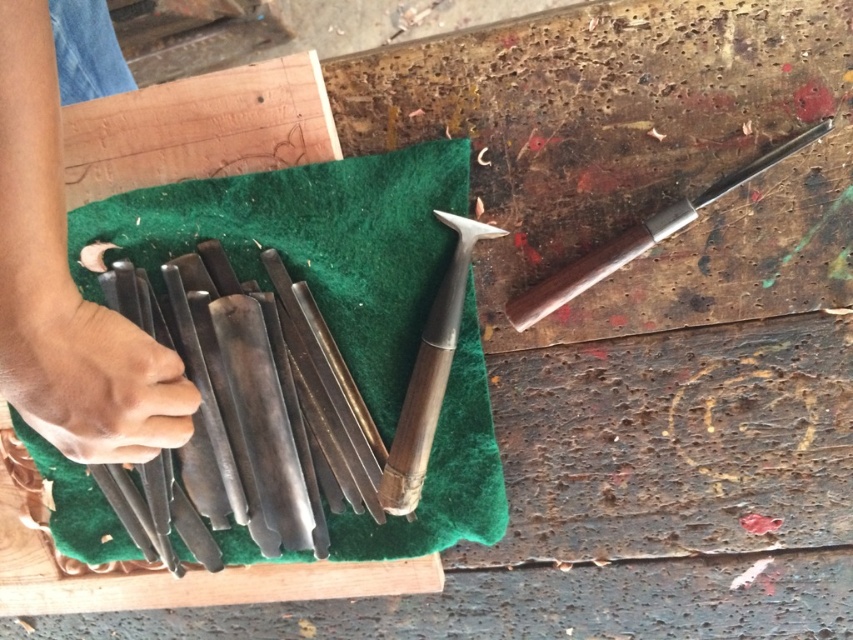
You are trying to determine if the smooth wood at upper left can fit horizontally across the wooden handle chisel at center. Based on their widths, can it fit?

The smooth wood at upper left might be wider than wooden handle chisel at center, so it may not fit horizontally across the chisel.

You are a woodworker trying to reach the chisels on the green felt at center. There is a dark skin hand at lower left in your way. Can you move around the hand to access the chisels without touching it?

The dark skin hand at lower left is behind the green felt at center, so you can move around it to access the chisels on the green felt at center without touching the hand.

You are organizing tools on a workbench and see the polished metal knife at center and the smooth wood at upper left. Which object is positioned lower on the workbench surface?

The polished metal knife at center is located below smooth wood at upper left, so it is positioned lower on the workbench surface.